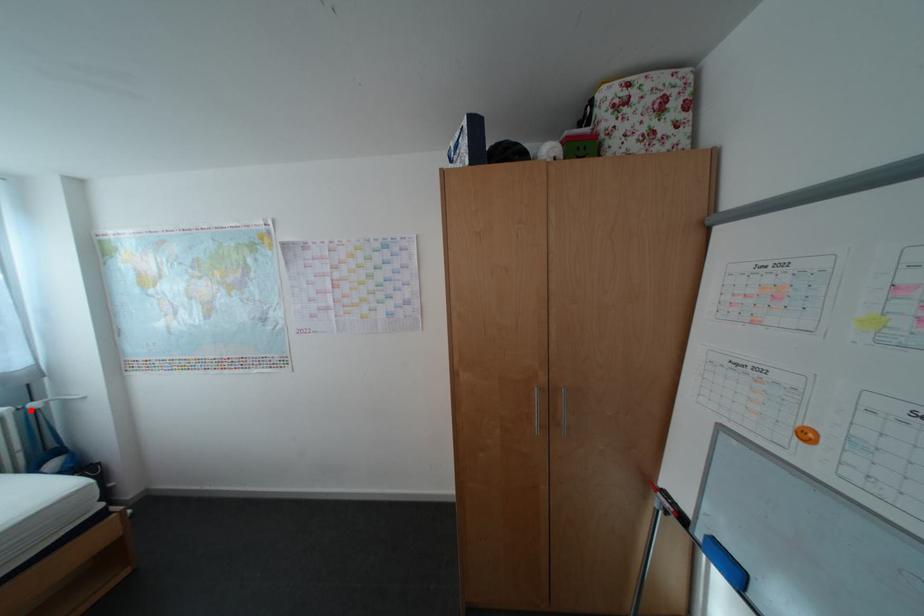
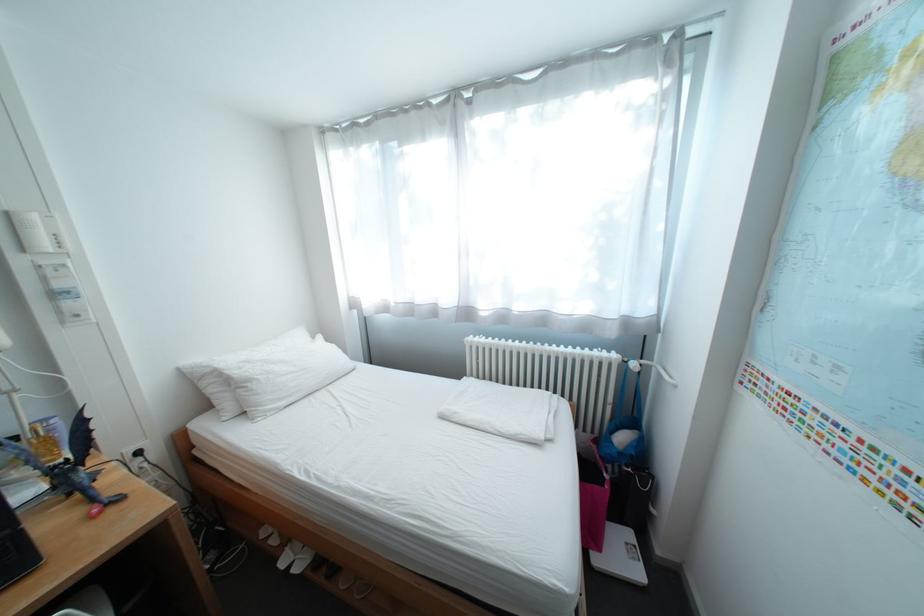
Locate, in the second image, the point that corresponds to the highlighted location in the first image.

(637, 362)